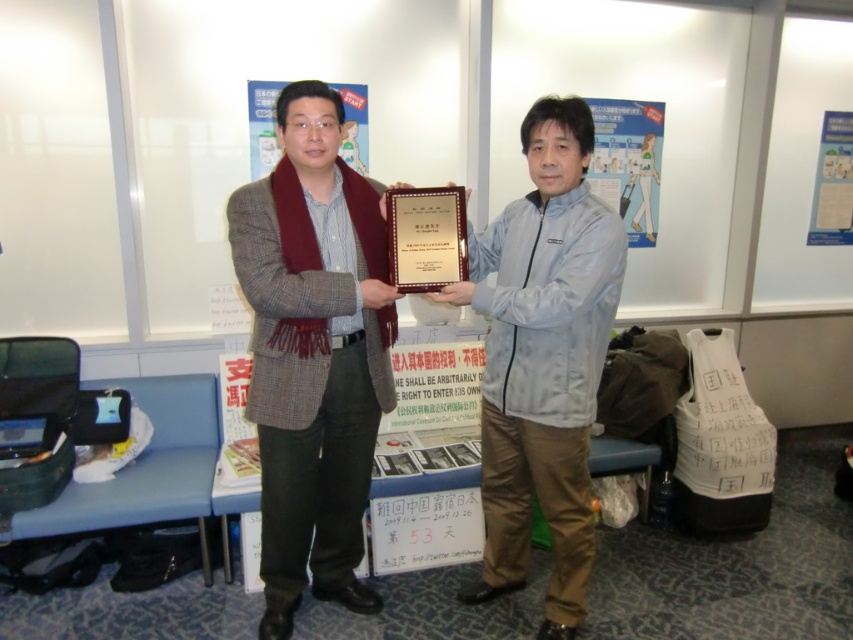
You are a photographer adjusting the camera settings to capture a clear photo of both the plaid wool coat at center and the light blue fabric jacket at center. Given that the camera has a depth of field that can focus on objects within a 15 inch range, will you be able to ensure both items are in focus?

The distance between the plaid wool coat at center and light blue fabric jacket at center is 17.14 inches, which exceeds the camera sensor range of 15 inches. Therefore, both items cannot be in focus simultaneously.

You are a photographer trying to capture a clear shot of the matte gold plaque at center without the plaid wool coat at center blocking it. Based on the scene description, can you adjust your position to achieve this?

The plaid wool coat at center is positioned on the left side of the matte gold plaque at center. To avoid the coat blocking the plaque, move to the right side of the scene so that the coat is no longer between you and the plaque.